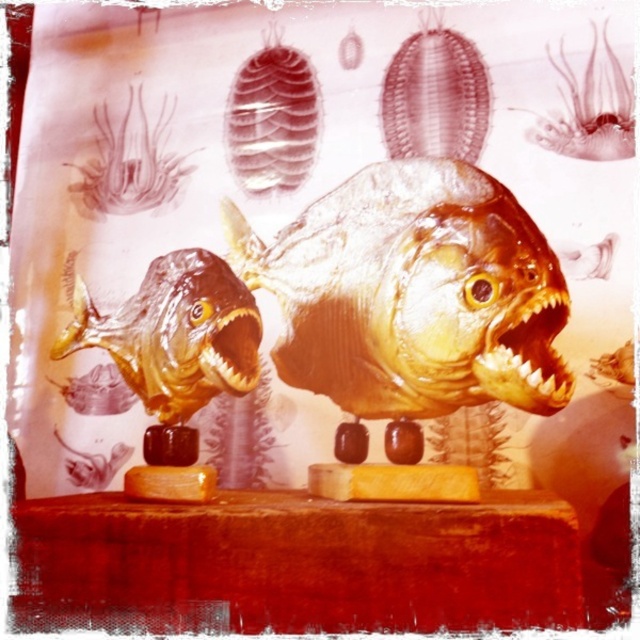
Question: Is translucent amber fish at upper left further to the viewer compared to shiny gold teeth at center?

Choices:
 (A) no
 (B) yes

Answer: (B)

Question: Estimate the real-world distances between objects in this image. Which object is closer to the shiny gold teeth at center?

Choices:
 (A) translucent amber mouth at center
 (B) shiny brown fish at left

Answer: (A)

Question: Which object is the closest to the shiny gold fish at center?

Choices:
 (A) shiny gold teeth at center
 (B) translucent amber fish at upper left
 (C) translucent amber mouth at center

Answer: (A)

Question: Does translucent amber fish at center have a larger size compared to translucent amber mouth at center?

Choices:
 (A) no
 (B) yes

Answer: (B)

Question: Does shiny gold teeth at center appear on the left side of translucent amber mouth at center?

Choices:
 (A) yes
 (B) no

Answer: (B)

Question: Which point is closer to the camera?

Choices:
 (A) translucent amber mouth at center
 (B) shiny brown fish at left
 (C) shiny gold teeth at center
 (D) translucent amber fish at upper left

Answer: (C)